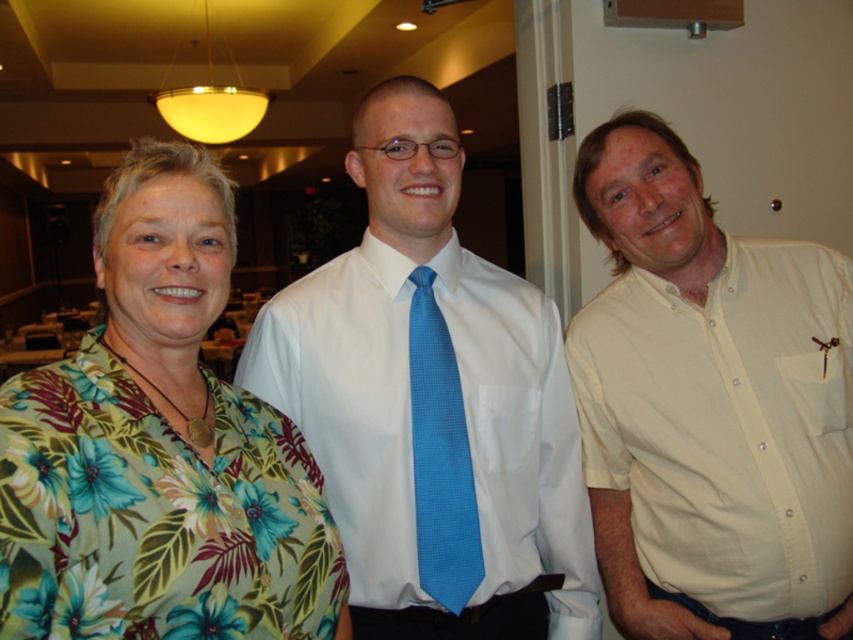
You are at the center of the room and want to move towards the white smooth shirt at center. Which direction should you move to reach it?

Since the white smooth shirt at center is located at point coordinates closer to the center, you should move straight ahead to reach it.

You are organizing a photo shoot and need to ensure that the floral print blouse at left and the blue silk tie at center are visible in the frame. Based on their positions and sizes, which object would require more horizontal space in the camera frame?

The floral print blouse at left might require more horizontal space in the camera frame since it might be wider than the blue silk tie at center.